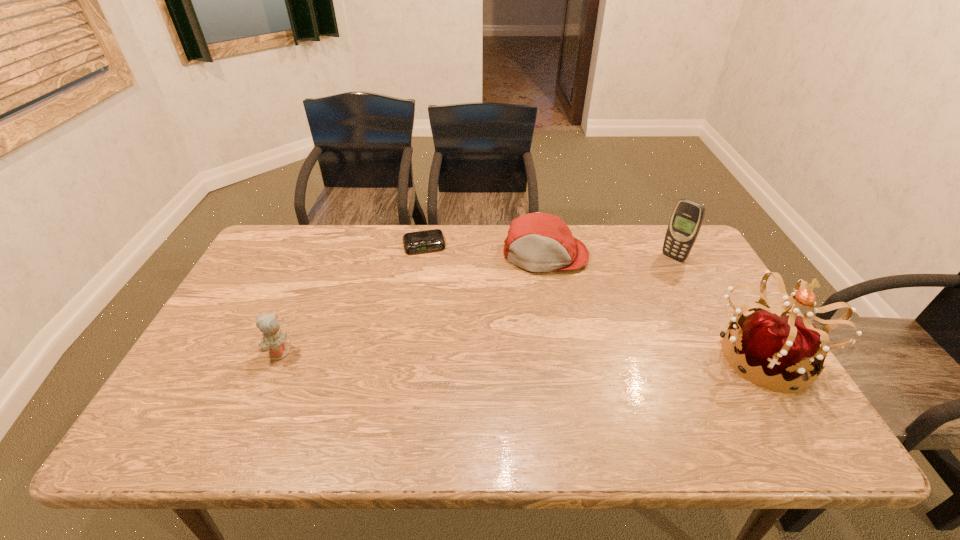
You are a GUI agent. You are given a task and a screenshot of the screen. Output one action in this format:
    pyautogui.click(x=<x>, y=<y>)
    Task: Click on the empty location between the cap and the teddy bear
    The image size is (960, 540).
    Given the screenshot: What is the action you would take?
    pyautogui.click(x=412, y=303)

The image size is (960, 540). I want to click on vacant area that lies between the leftmost object and the second object from left to right, so click(x=351, y=299).

Identify which object is the second closest to the tallest object. Please provide its 2D coordinates. Your answer should be formatted as a tuple, i.e. [(x, y)], where the tuple contains the x and y coordinates of a point satisfying the conditions above.

[(538, 242)]

Identify which object is the closest to the tiara. Please provide its 2D coordinates. Your answer should be formatted as a tuple, i.e. [(x, y)], where the tuple contains the x and y coordinates of a point satisfying the conditions above.

[(688, 215)]

I want to click on free spot that satisfies the following two spatial constraints: 1. on the front side of the cap; 2. on the right side of the cellular telephone, so click(546, 257).